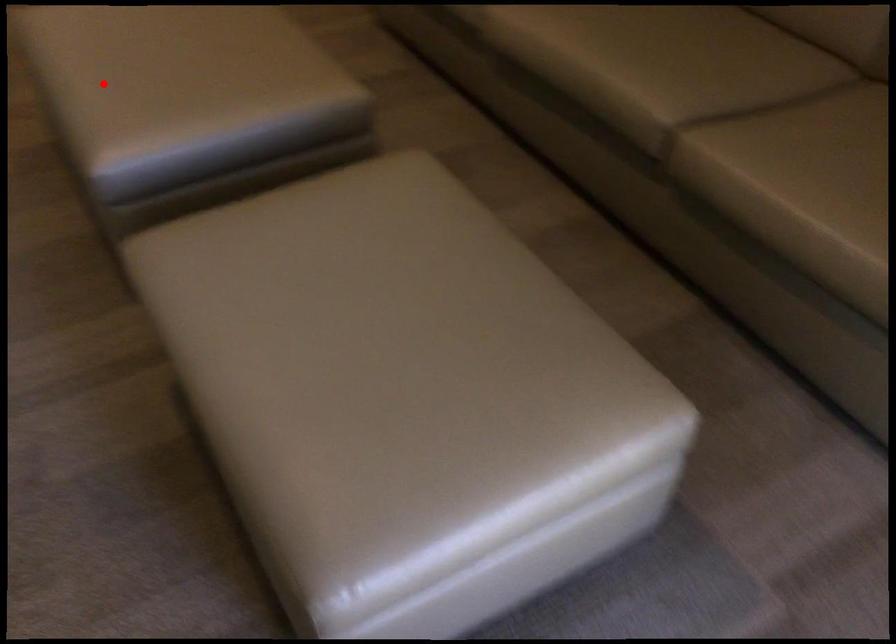
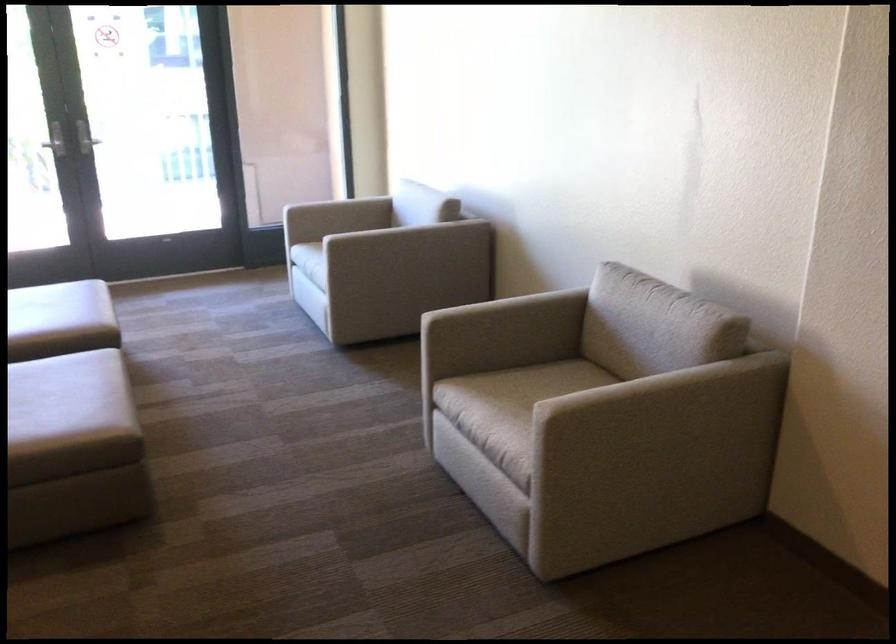
Question: A red point is marked in image1. In image2, is the corresponding 3D point closer to the camera or farther? Reply with the corresponding letter.

Choices:
 (A) The corresponding 3D point is closer.
 (B) The corresponding 3D point is farther.

Answer: (B)